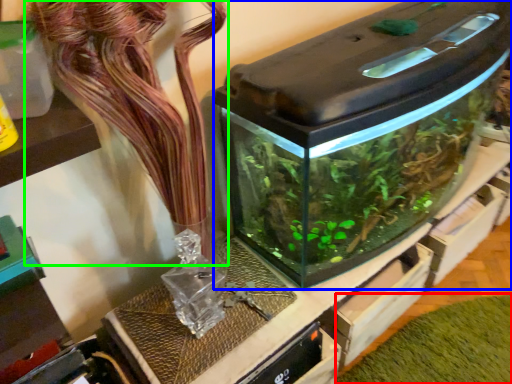
Question: Which is nearer to the plant (highlighted by a red box)? water tank (highlighted by a blue box) or flower (highlighted by a green box).

Choices:
 (A) water tank
 (B) flower

Answer: (A)